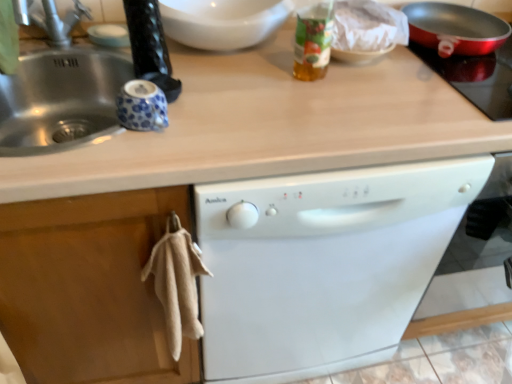
This screenshot has height=384, width=512. Identify the location of free spot below white glossy bowl at upper center (from a real-world perspective). (227, 53).